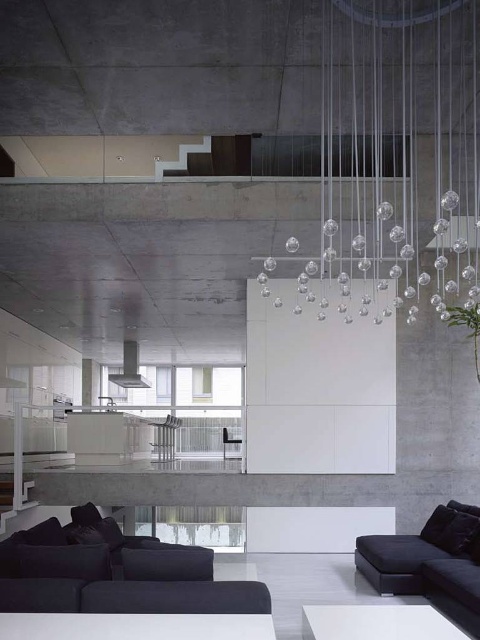
Question: Considering the real-world distances, which object is closest to the white glossy coffee table at lower center?

Choices:
 (A) dark gray fabric couch at lower left
 (B) black leather couch at lower right
 (C) metallic silver chair at center

Answer: (A)

Question: Among these objects, which one is farthest from the camera?

Choices:
 (A) white glossy coffee table at lower center
 (B) metallic silver chair at center

Answer: (B)

Question: Is transparent glass chandelier at upper center to the right of white glossy coffee table at lower center from the viewer's perspective?

Choices:
 (A) no
 (B) yes

Answer: (B)

Question: Is black leather couch at lower right further to camera compared to metallic silver chair at center?

Choices:
 (A) yes
 (B) no

Answer: (B)

Question: Estimate the real-world distances between objects in this image. Which object is farther from the transparent glass chandelier at upper center?

Choices:
 (A) metallic silver chair at center
 (B) black leather couch at lower right

Answer: (A)

Question: Is transparent glass chandelier at upper center thinner than metallic silver chair at center?

Choices:
 (A) no
 (B) yes

Answer: (A)